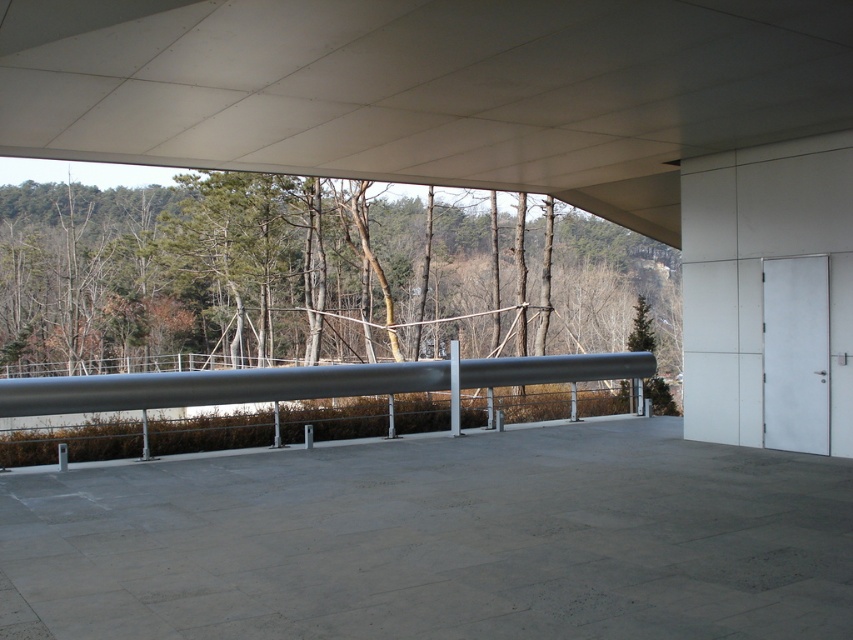
Does gray concrete at center have a larger size compared to metallic gray railing at upper center?

No.

Does gray concrete at center appear over metallic gray railing at upper center?

No, gray concrete at center is not above metallic gray railing at upper center.

Where is `gray concrete at center`? Image resolution: width=853 pixels, height=640 pixels. gray concrete at center is located at coordinates (437, 540).

Where is `gray concrete at center`? gray concrete at center is located at coordinates (x=437, y=540).

Consider the image. Is metallic gray railing at upper center wider than green matte tree at center?

Incorrect, metallic gray railing at upper center's width does not surpass green matte tree at center's.

Is point (592, 84) closer to viewer compared to point (398, 264)?

That is True.

What are the coordinates of `metallic gray railing at upper center` in the screenshot? It's located at (428, 88).

Is gray concrete at center thinner than silver metallic rail at center?

Indeed, gray concrete at center has a lesser width compared to silver metallic rail at center.

Is point (45, 499) closer to viewer compared to point (45, 394)?

Yes, point (45, 499) is in front of point (45, 394).

You are a GUI agent. You are given a task and a screenshot of the screen. Output one action in this format:
    pyautogui.click(x=<x>, y=<y>)
    Task: Click on the gray concrete at center
    The height and width of the screenshot is (640, 853).
    Given the screenshot: What is the action you would take?
    pyautogui.click(x=437, y=540)